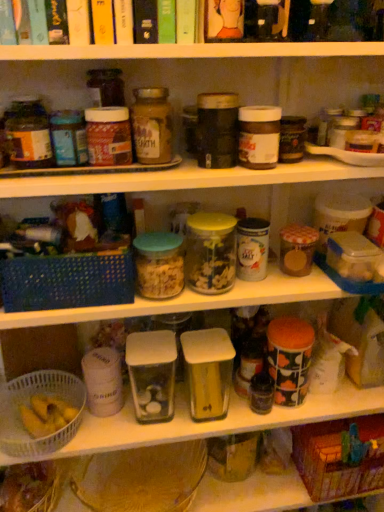
Question: Considering their positions, is blue woven basket at left, which is the 2th basket from right to left, located in front of or behind matte brown jar at upper left, which ranks as the second bottle in right-to-left order?

Choices:
 (A) front
 (B) behind

Answer: (B)

Question: Is point (26, 265) positioned closer to the camera than point (21, 118)?

Choices:
 (A) farther
 (B) closer

Answer: (A)

Question: Based on their relative distances, which object is nearer to the matte glass jar at center, arranged as the 2th bottle when viewed from the left?

Choices:
 (A) translucent glass jar at center
 (B) translucent plastic bag at lower left
 (C) blue woven basket at left, which ranks as the 3th basket in bottom-to-top order
 (D) brown woven basket at lower right, which is the 3th basket from left to right
 (E) white plastic basket at lower left, the 3th basket in the right-to-left sequence

Answer: (A)

Question: Based on their relative distances, which object is nearer to the translucent plastic bag at lower left?

Choices:
 (A) matte brown jar at upper left, which ranks as the second bottle in right-to-left order
 (B) blue woven basket at left, which ranks as the 3th basket in bottom-to-top order
 (C) white plastic basket at lower left, the 3th basket in the right-to-left sequence
 (D) translucent glass jar at center
 (E) matte glass jar at center, arranged as the 2th bottle when viewed from the left

Answer: (C)